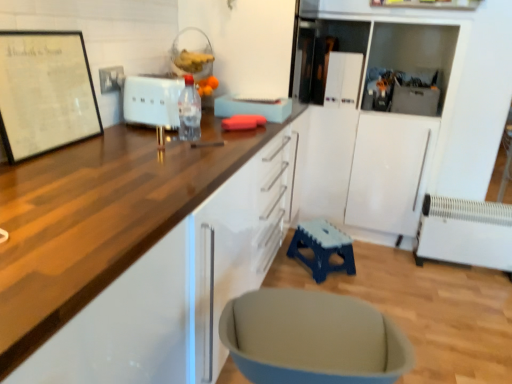
Question: Is metallic gray toolbox at upper right, acting as the 2th appliance starting from the front, outside of white matte toaster at center, the 3th appliance from the right?

Choices:
 (A) yes
 (B) no

Answer: (A)

Question: Could you tell me if metallic gray toolbox at upper right, the 3th appliance in the left-to-right sequence, is turned towards white matte toaster at center, placed as the first appliance when sorted from left to right?

Choices:
 (A) no
 (B) yes

Answer: (A)

Question: Considering the relative sizes of metallic gray toolbox at upper right, marked as the 2th appliance in a back-to-front arrangement, and white matte toaster at center, the 3th appliance from the right, in the image provided, is metallic gray toolbox at upper right, marked as the 2th appliance in a back-to-front arrangement, wider than white matte toaster at center, the 3th appliance from the right,?

Choices:
 (A) no
 (B) yes

Answer: (B)

Question: Is white matte toaster at center, which is the first appliance in front-to-back order, inside metallic gray toolbox at upper right, the first appliance in the right-to-left sequence?

Choices:
 (A) yes
 (B) no

Answer: (B)

Question: Is metallic gray toolbox at upper right, marked as the 2th appliance in a back-to-front arrangement, smaller than white matte toaster at center, which is the first appliance in front-to-back order?

Choices:
 (A) yes
 (B) no

Answer: (B)

Question: Does point (135, 87) appear closer or farther from the camera than point (458, 253)?

Choices:
 (A) closer
 (B) farther

Answer: (A)

Question: Based on their sizes in the image, would you say white matte toaster at center, which is the first appliance in front-to-back order, is bigger or smaller than white plastic radiator at lower right?

Choices:
 (A) small
 (B) big

Answer: (A)

Question: From the image's perspective, is white matte toaster at center, placed as the first appliance when sorted from left to right, above or below white plastic radiator at lower right?

Choices:
 (A) above
 (B) below

Answer: (A)

Question: In terms of height, does white matte toaster at center, placed as the first appliance when sorted from left to right, look taller or shorter compared to white plastic radiator at lower right?

Choices:
 (A) tall
 (B) short

Answer: (B)

Question: Considering the positions of point (308, 322) and point (185, 91), is point (308, 322) closer or farther from the camera than point (185, 91)?

Choices:
 (A) closer
 (B) farther

Answer: (A)

Question: From a real-world perspective, is matte gray swivel chair at lower center physically located above or below transparent plastic bottle at center?

Choices:
 (A) below
 (B) above

Answer: (A)

Question: From the image's perspective, is matte gray swivel chair at lower center positioned above or below transparent plastic bottle at center?

Choices:
 (A) above
 (B) below

Answer: (B)

Question: Is matte gray swivel chair at lower center wider or thinner than transparent plastic bottle at center?

Choices:
 (A) wide
 (B) thin

Answer: (A)

Question: Which is correct: white plastic radiator at lower right is inside white matte toaster at center, the 3th appliance from the right, or outside of it?

Choices:
 (A) inside
 (B) outside

Answer: (B)

Question: From a real-world perspective, is white plastic radiator at lower right above or below white matte toaster at center, which is the third appliance in back-to-front order?

Choices:
 (A) above
 (B) below

Answer: (B)